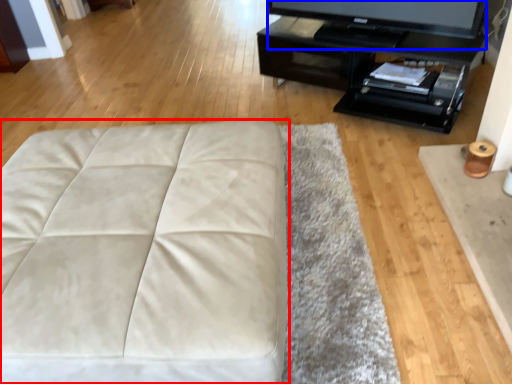
Question: Which of the following is the farthest to the observer, furniture (highlighted by a red box) or television (highlighted by a blue box)?

Choices:
 (A) furniture
 (B) television

Answer: (B)